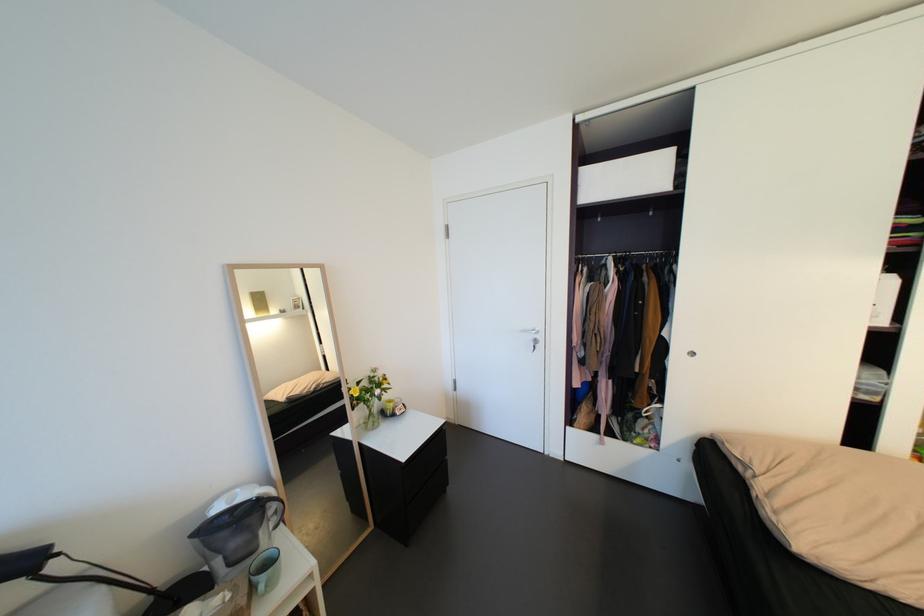
Image resolution: width=924 pixels, height=616 pixels. I want to click on metal clothing rail, so click(629, 257).